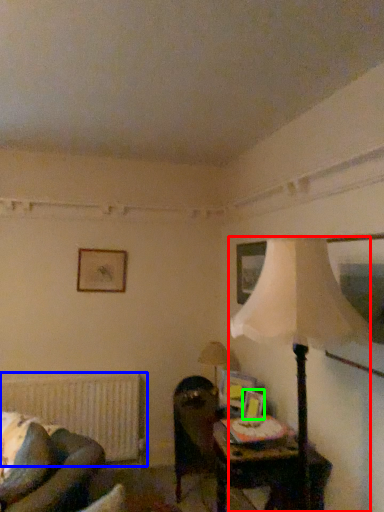
Question: Which object is positioned farthest from lamp (highlighted by a red box)? Select from radiator (highlighted by a blue box) and picture frame (highlighted by a green box).

Choices:
 (A) radiator
 (B) picture frame

Answer: (A)